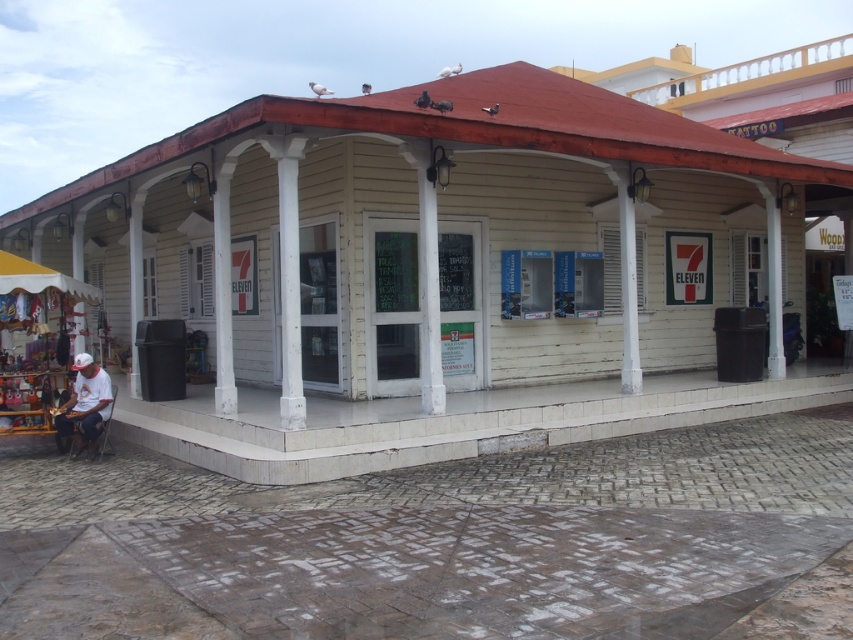
Can you confirm if white wood 7-eleven at center is thinner than white matte shirt at lower left?

Incorrect, white wood 7-eleven at center's width is not less than white matte shirt at lower left's.

At what (x,y) coordinates should I click in order to perform the action: click on white wood 7-eleven at center. Please return your answer as a coordinate pair (x, y). The height and width of the screenshot is (640, 853). Looking at the image, I should click on (438, 269).

Which is in front, point (436, 440) or point (74, 433)?

Point (436, 440) is more forward.

Find the location of `white wood 7-eleven at center`. white wood 7-eleven at center is located at coordinates (438, 269).

Based on the photo, which is more to the right, white matte shirt at lower left or yellow fabric canopy at lower left?

Positioned to the right is white matte shirt at lower left.

Does white matte shirt at lower left appear on the left side of yellow fabric canopy at lower left?

No, white matte shirt at lower left is not to the left of yellow fabric canopy at lower left.

The image size is (853, 640). Find the location of `white matte shirt at lower left`. white matte shirt at lower left is located at coordinates (85, 404).

Can you confirm if white wood 7-eleven at center is thinner than yellow fabric canopy at lower left?

No, white wood 7-eleven at center is not thinner than yellow fabric canopy at lower left.

Can you confirm if white wood 7-eleven at center is positioned to the right of yellow fabric canopy at lower left?

Yes, white wood 7-eleven at center is to the right of yellow fabric canopy at lower left.

Which is behind, point (332, 342) or point (41, 284)?

Positioned behind is point (332, 342).

Locate an element on the screen. The height and width of the screenshot is (640, 853). white wood 7-eleven at center is located at coordinates (438, 269).